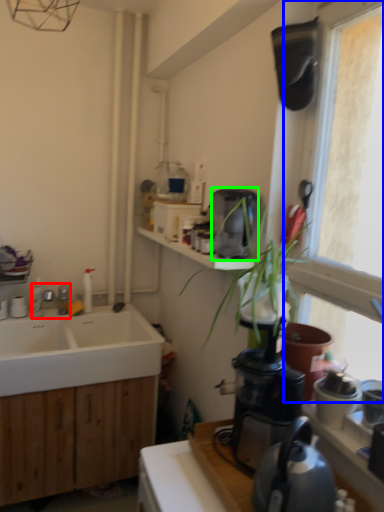
Question: Considering the real-world distances, which object is closest to tap (highlighted by a red box)? window (highlighted by a blue box) or coffee maker (highlighted by a green box).

Choices:
 (A) window
 (B) coffee maker

Answer: (B)